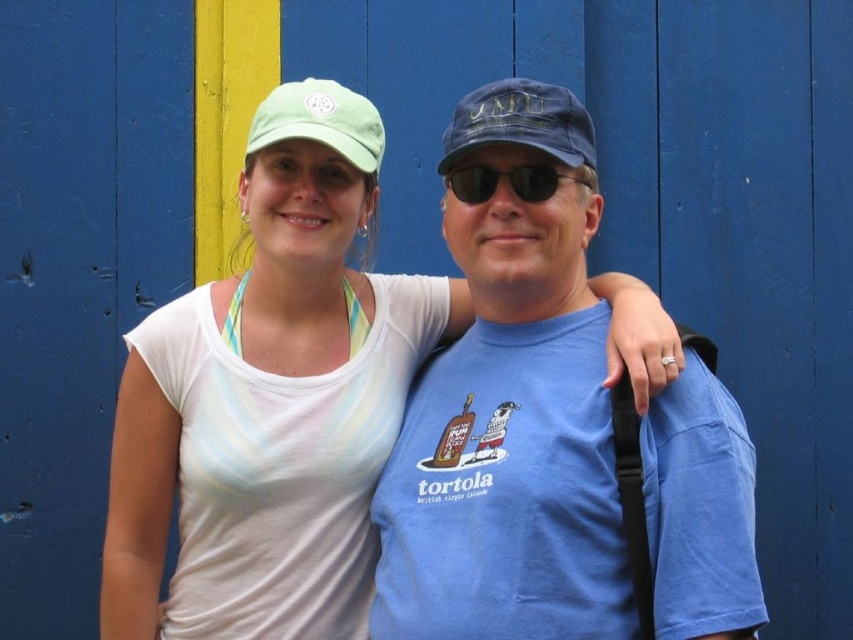
You are a photographer trying to capture a closeup of the green fabric baseball cap at upper center without including the white fabric tank top at center in the frame. Is this possible given their positions?

The white fabric tank top at center is to the left of the green fabric baseball cap at upper center, so if you position your camera to the right side of the green fabric baseball cap at upper center, you can capture it without including the white fabric tank top at center.

You are trying to decide which object is higher up in the image. You see the green fabric baseball cap at upper center and the sunglasses at center. Which one is positioned higher?

The green fabric baseball cap at upper center is much taller than sunglasses at center, so the green fabric baseball cap at upper center is positioned higher.